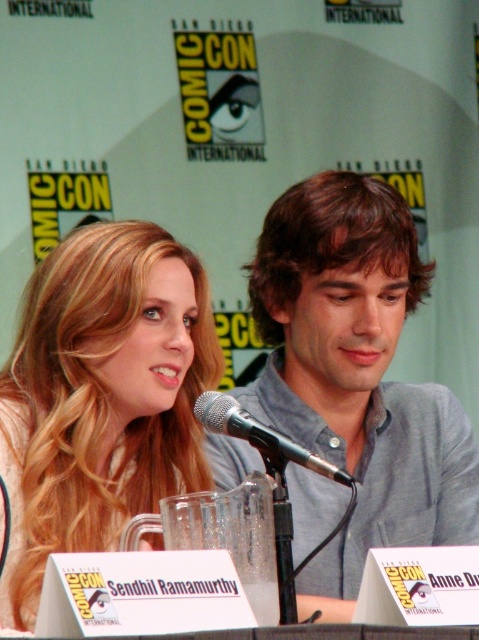
You are a photographer at Comic Con and need to capture a group photo of the panelists. You notice the gray cotton shirt at center and the blonde hair at upper left. Which object is wider in the image?

The gray cotton shirt at center is wider than the blonde hair at upper left according to the description.

You are a photographer at Comic Con who wants to capture a closeup of the blonde hair at upper left and the silver metallic microphone at center. Which object is wider in the image?

The blonde hair at upper left is wider than the silver metallic microphone at center in the image.